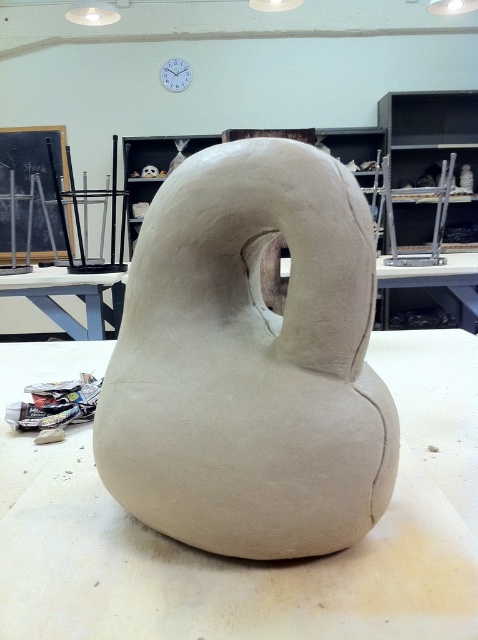
Does white matte table at center lie in front of white plastic clock at upper center?

Yes, white matte table at center is in front of white plastic clock at upper center.

Is the position of white matte table at center more distant than that of white plastic clock at upper center?

No, it is not.

Which is behind, point (32, 272) or point (178, 67)?

Point (178, 67)

I want to click on white matte table at center, so click(71, 294).

Is clay sculpture at center below white matte table at center?

Indeed, clay sculpture at center is positioned under white matte table at center.

Which is behind, point (258, 289) or point (73, 284)?

Positioned behind is point (73, 284).

At what (x,y) coordinates should I click in order to perform the action: click on clay sculpture at center. Please return your answer as a coordinate pair (x, y). This screenshot has height=640, width=478. Looking at the image, I should click on (249, 362).

Is white clay sculpture at center bigger than white matte table at center?

Incorrect, white clay sculpture at center is not larger than white matte table at center.

Is white clay sculpture at center thinner than white matte table at center?

No.

Does point (52, 598) come closer to viewer compared to point (24, 276)?

Yes, it is.

I want to click on white clay sculpture at center, so click(242, 561).